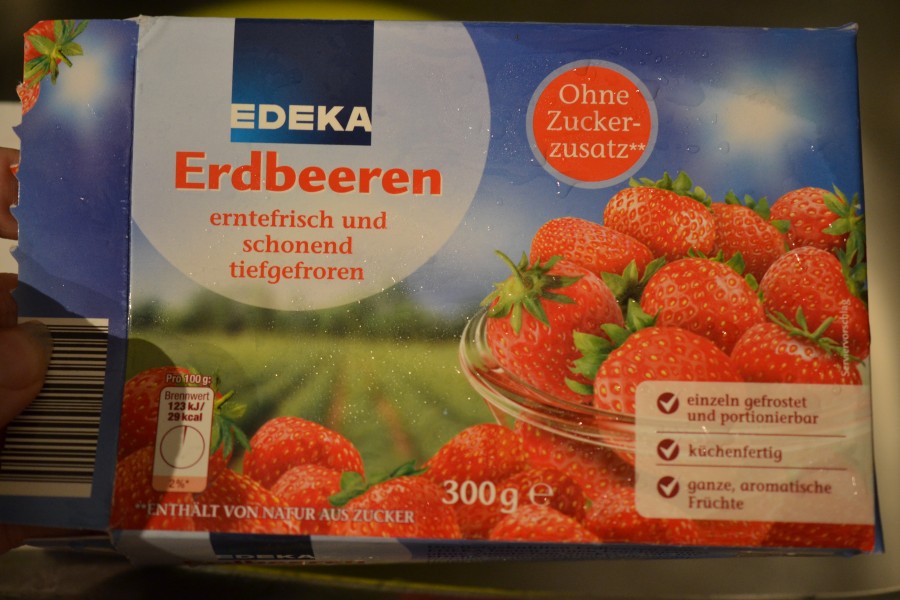
At what (x,y) coordinates should I click in order to perform the action: click on bowl. Please return your answer as a coordinate pair (x, y). This screenshot has width=900, height=600. Looking at the image, I should click on (523, 404).